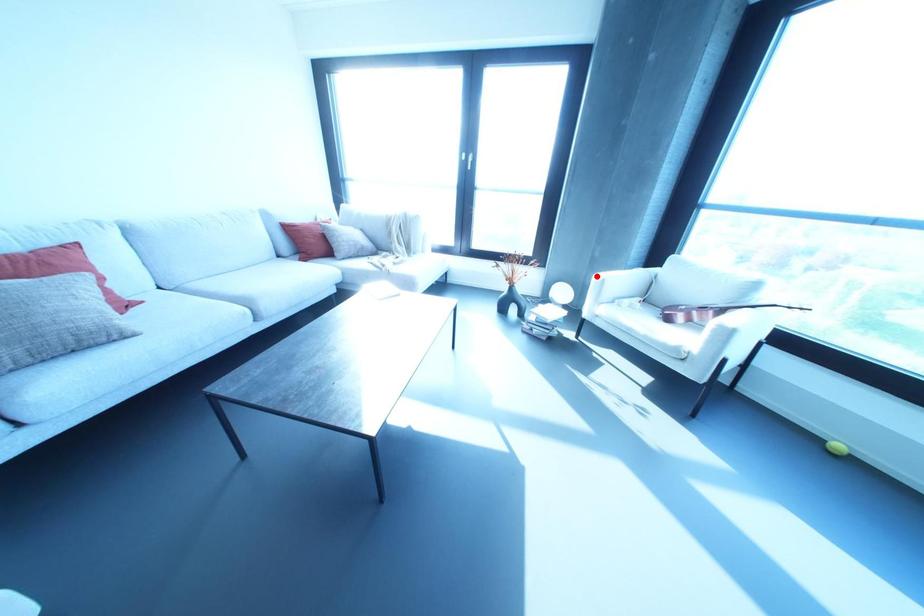
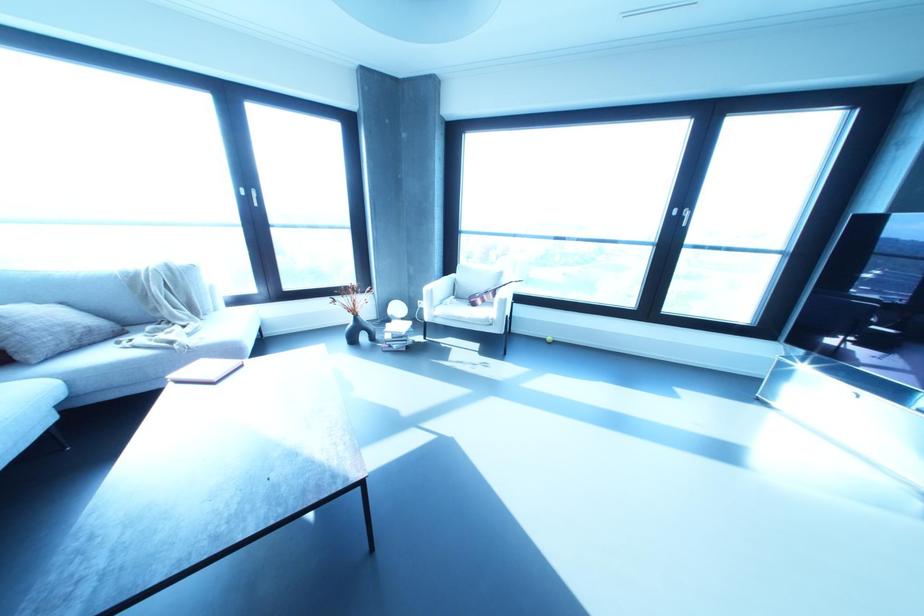
Locate, in the second image, the point that corresponds to the highlighted location in the first image.

(426, 288)